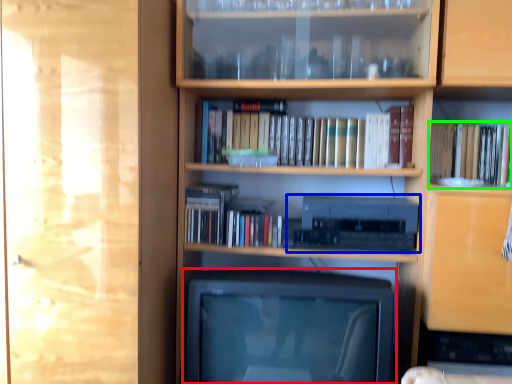
Question: Which object is the closest to the television (highlighted by a red box)? Choose among these: stereo (highlighted by a blue box) or book (highlighted by a green box).

Choices:
 (A) stereo
 (B) book

Answer: (A)